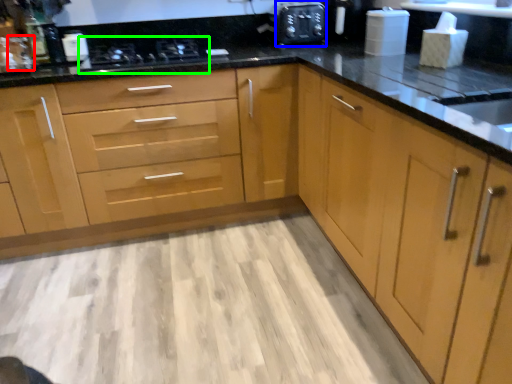
Question: Considering the real-world distances, which object is farthest from faucet (highlighted by a red box)? appliance (highlighted by a blue box) or stove (highlighted by a green box)?

Choices:
 (A) appliance
 (B) stove

Answer: (A)